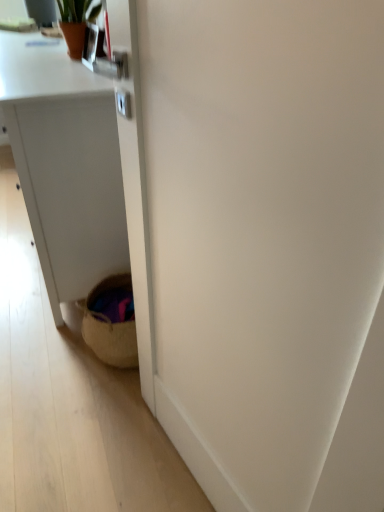
Question: Is terracotta pot at upper left taller than woven basket at lower left?

Choices:
 (A) yes
 (B) no

Answer: (B)

Question: From the image's perspective, is terracotta pot at upper left above woven basket at lower left?

Choices:
 (A) no
 (B) yes

Answer: (B)

Question: Is terracotta pot at upper left positioned in front of woven basket at lower left?

Choices:
 (A) no
 (B) yes

Answer: (A)

Question: Is terracotta pot at upper left thinner than woven basket at lower left?

Choices:
 (A) no
 (B) yes

Answer: (A)

Question: Would you say terracotta pot at upper left contains woven basket at lower left?

Choices:
 (A) no
 (B) yes

Answer: (A)

Question: Looking at their shapes, would you say terracotta pot at upper left is wider or thinner than woven basket at lower left?

Choices:
 (A) wide
 (B) thin

Answer: (A)

Question: From a real-world perspective, is terracotta pot at upper left above or below woven basket at lower left?

Choices:
 (A) above
 (B) below

Answer: (A)

Question: In the image, is terracotta pot at upper left positioned in front of or behind woven basket at lower left?

Choices:
 (A) front
 (B) behind

Answer: (B)

Question: Which is correct: terracotta pot at upper left is inside woven basket at lower left, or outside of it?

Choices:
 (A) outside
 (B) inside

Answer: (A)

Question: Considering the positions of woven basket at lower left and white matte desk at lower left in the image, is woven basket at lower left taller or shorter than white matte desk at lower left?

Choices:
 (A) short
 (B) tall

Answer: (B)

Question: In the image, is woven basket at lower left positioned in front of or behind white matte desk at lower left?

Choices:
 (A) behind
 (B) front

Answer: (B)

Question: Is point (355, 440) positioned closer to the camera than point (91, 264)?

Choices:
 (A) farther
 (B) closer

Answer: (B)

Question: Would you say woven basket at lower left is inside or outside white matte desk at lower left?

Choices:
 (A) inside
 (B) outside

Answer: (B)

Question: Is white matte desk at lower left spatially inside terracotta pot at upper left, or outside of it?

Choices:
 (A) inside
 (B) outside

Answer: (B)

Question: Does point (52, 240) appear closer or farther from the camera than point (74, 57)?

Choices:
 (A) farther
 (B) closer

Answer: (B)